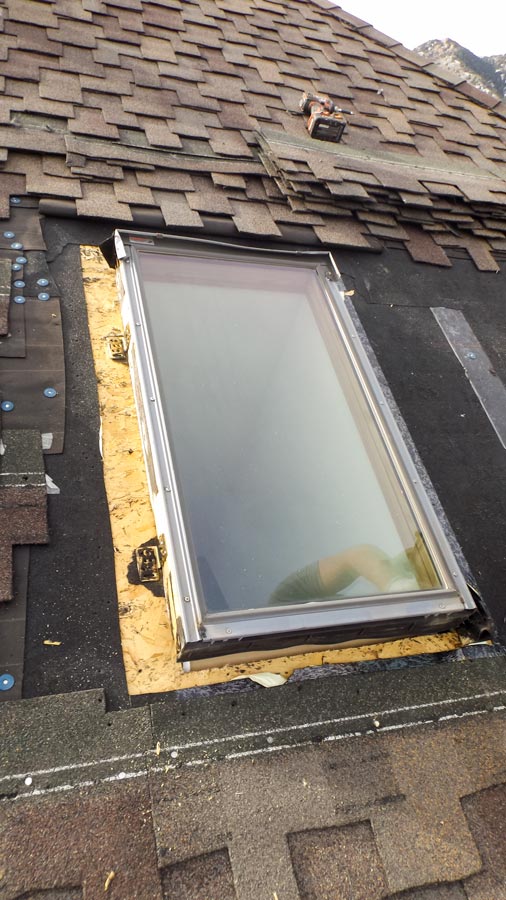
Identify the location of window. (247, 466).